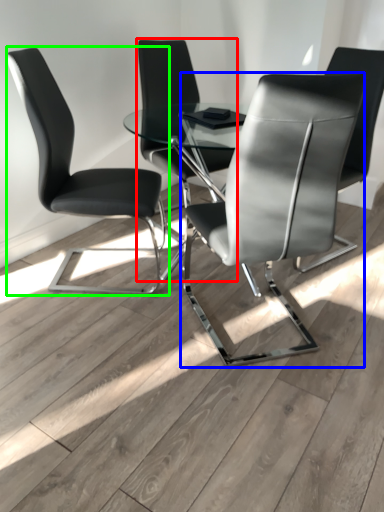
Question: Which object is positioned closest to chair (highlighted by a red box)? Select from chair (highlighted by a blue box) and chair (highlighted by a green box).

Choices:
 (A) chair
 (B) chair

Answer: (B)